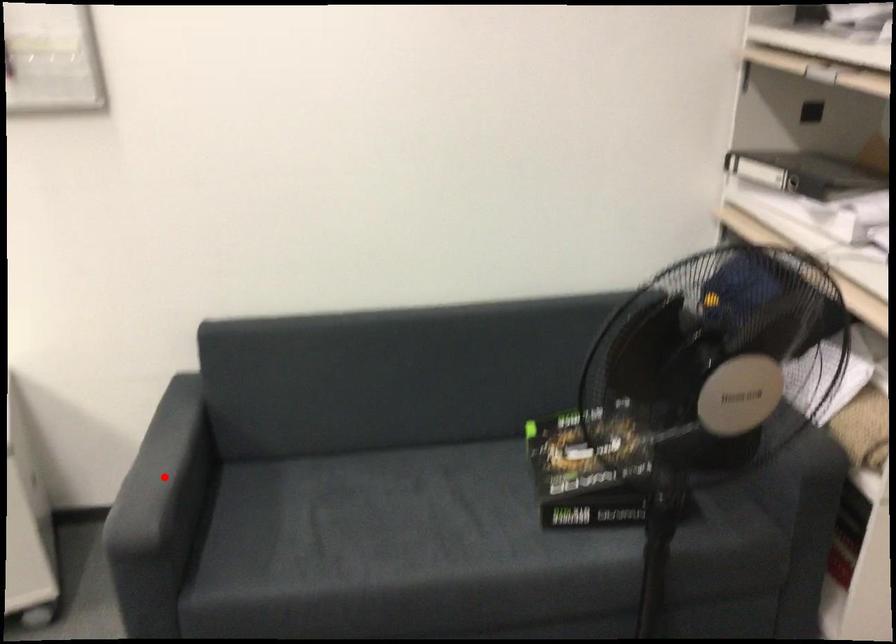
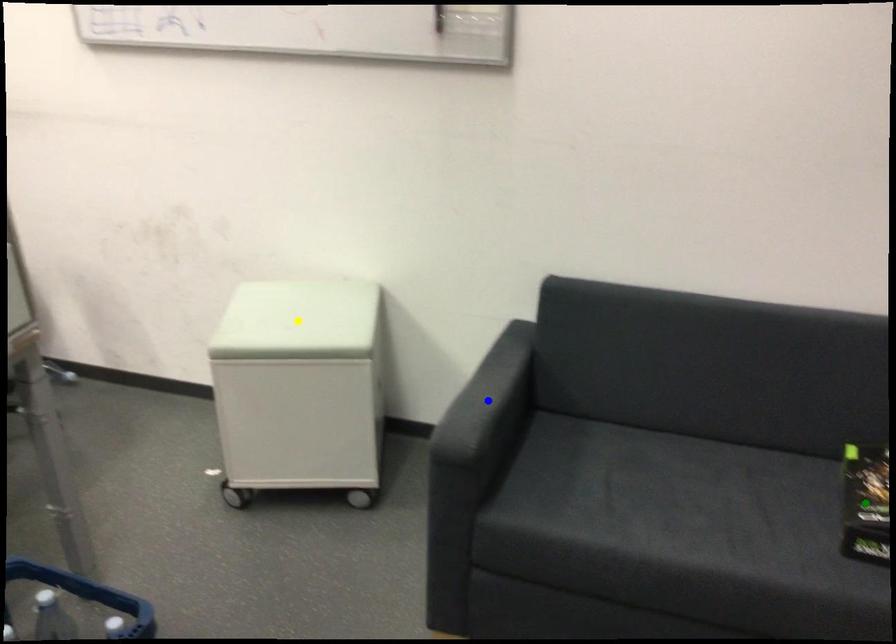
Question: I am providing you with two images of the same scene from different viewpoints. A red point is marked on the first image. You are given multiple points on the second image. Can you choose the point in image 2 that corresponds to the point in image 1?

Choices:
 (A) green point
 (B) blue point
 (C) yellow point

Answer: (B)